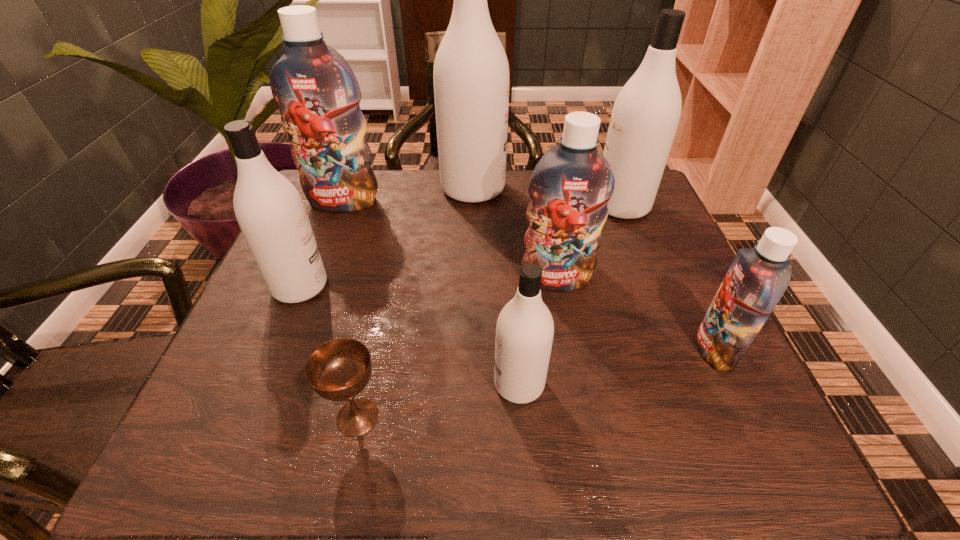
The height and width of the screenshot is (540, 960). In order to click on the third closest blue shampoo to the nearest white shampoo in this screenshot , I will do `click(318, 95)`.

You are a GUI agent. You are given a task and a screenshot of the screen. Output one action in this format:
    pyautogui.click(x=<x>, y=<y>)
    Task: Click on the vacant space that satisfies the following two spatial constraints: 1. on the front-facing side of the third smallest white shampoo; 2. on the front side of the sixth object from right to left
    The image size is (960, 540).
    Given the screenshot: What is the action you would take?
    pyautogui.click(x=706, y=417)